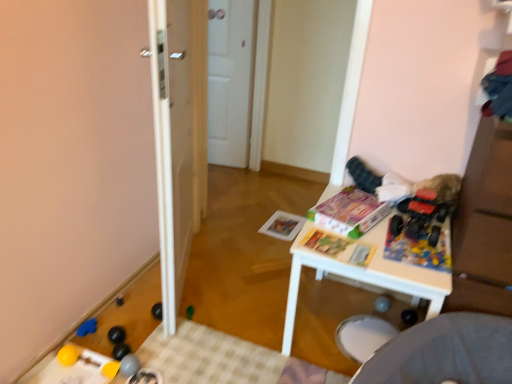
Question: Could you tell me if matte paper magazine at center, which appears as the 3th magazine when viewed from the back, is facing white glossy door at center?

Choices:
 (A) yes
 (B) no

Answer: (B)

Question: Is matte paper magazine at center, the first magazine positioned from the front, positioned before white glossy door at center?

Choices:
 (A) yes
 (B) no

Answer: (B)

Question: From a real-world perspective, is matte paper magazine at center, the first magazine positioned from the front, physically below white glossy door at center?

Choices:
 (A) yes
 (B) no

Answer: (A)

Question: Does matte paper magazine at center, which appears as the 3th magazine when viewed from the back, come behind white glossy door at center?

Choices:
 (A) yes
 (B) no

Answer: (A)

Question: Is white glossy door at center a part of matte paper magazine at center, the first magazine positioned from the front?

Choices:
 (A) no
 (B) yes

Answer: (A)

Question: From the image's perspective, is matte paper magazine at center, positioned as the third magazine in front-to-back order, positioned above or below white matte door at center?

Choices:
 (A) above
 (B) below

Answer: (B)

Question: Considering the positions of point (285, 228) and point (208, 157), is point (285, 228) closer or farther from the camera than point (208, 157)?

Choices:
 (A) closer
 (B) farther

Answer: (A)

Question: Is matte paper magazine at center, positioned as the third magazine in front-to-back order, taller or shorter than white matte door at center?

Choices:
 (A) tall
 (B) short

Answer: (B)

Question: Is matte paper magazine at center, positioned as the third magazine in front-to-back order, inside the boundaries of white matte door at center, or outside?

Choices:
 (A) inside
 (B) outside

Answer: (B)

Question: From the image's perspective, is rubber yellow ball at lower left, which is the 4th toy from right to left, above or below blue rubber toy at lower left, the second toy when ordered from left to right?

Choices:
 (A) above
 (B) below

Answer: (B)

Question: In the image, is rubber yellow ball at lower left, which is the 4th toy from right to left, on the left side or the right side of blue rubber toy at lower left, which is counted as the third toy, starting from the top?

Choices:
 (A) left
 (B) right

Answer: (B)

Question: Based on their sizes in the image, would you say rubber yellow ball at lower left, arranged as the sixth toy when viewed from the top, is bigger or smaller than blue rubber toy at lower left, the fifth toy viewed from the right?

Choices:
 (A) small
 (B) big

Answer: (A)

Question: Is point (114, 372) closer or farther from the camera than point (89, 332)?

Choices:
 (A) closer
 (B) farther

Answer: (A)

Question: From the image's perspective, is white plastic table at center located above or below white glossy door at center?

Choices:
 (A) below
 (B) above

Answer: (A)

Question: Considering the positions of white plastic table at center and white glossy door at center in the image, is white plastic table at center taller or shorter than white glossy door at center?

Choices:
 (A) short
 (B) tall

Answer: (A)